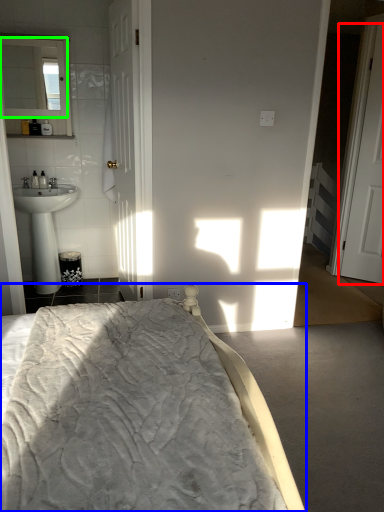
Question: Which object is positioned closest to door (highlighted by a red box)? Select from bed (highlighted by a blue box) and mirror (highlighted by a green box).

Choices:
 (A) bed
 (B) mirror

Answer: (B)